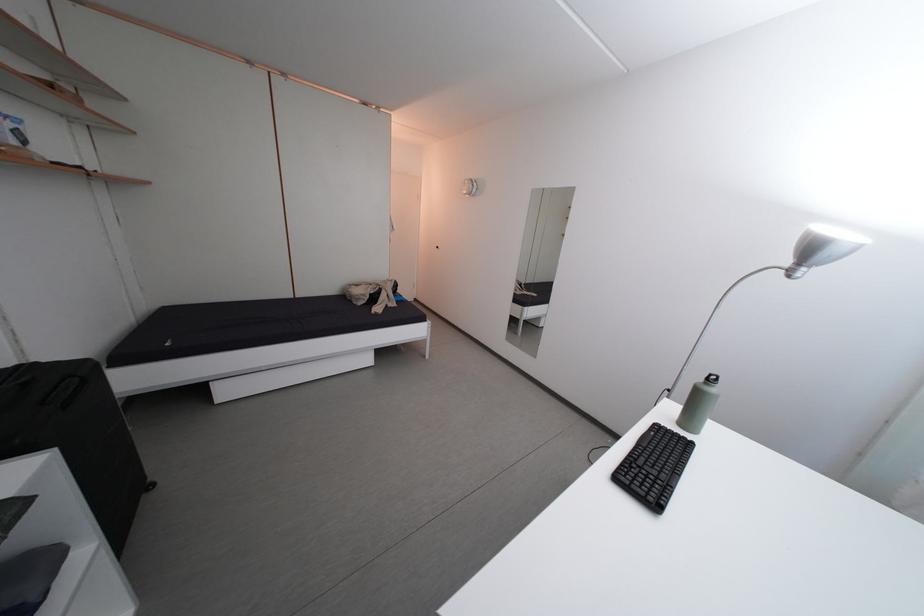
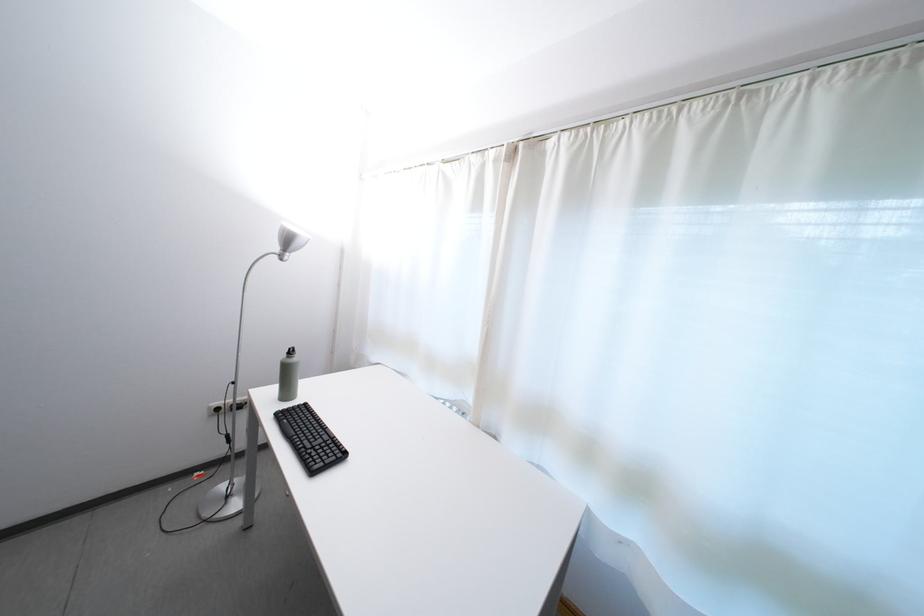
In the second image, find the point that corresponds to the point at 663,477 in the first image.

(330, 447)